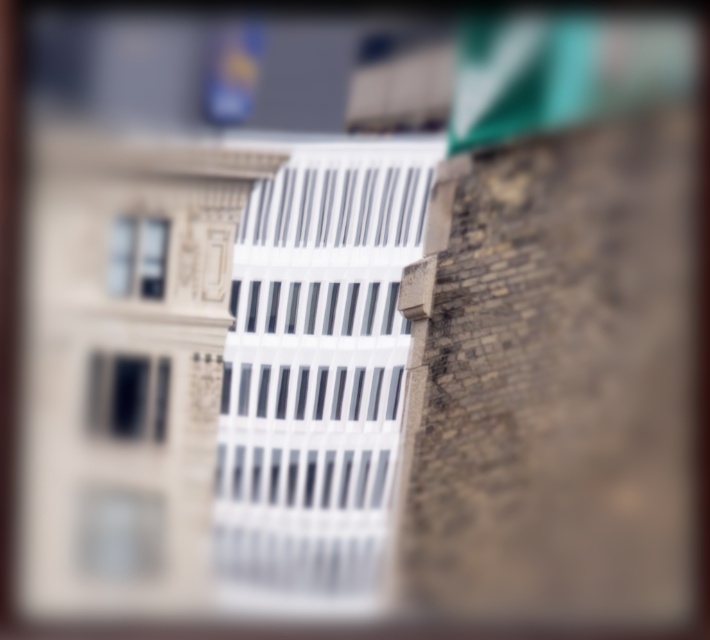
How distant is matte black window at center from clear glass window at upper left?

matte black window at center is 38.50 inches from clear glass window at upper left.

Can you confirm if matte black window at center is positioned above clear glass window at upper left?

Incorrect, matte black window at center is not positioned above clear glass window at upper left.

Identify the location of matte black window at center. (126, 396).

The width and height of the screenshot is (710, 640). Find the location of `matte black window at center`. matte black window at center is located at coordinates (126, 396).